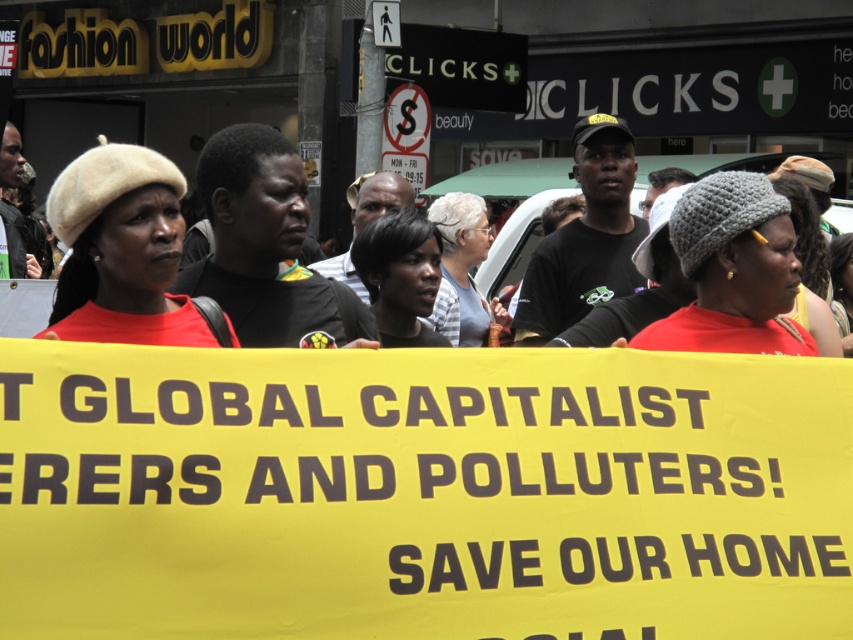
Looking at this image, how much distance is there between gray knitted hat at center and dark brown hair at center?

gray knitted hat at center and dark brown hair at center are 4.28 feet apart.

The width and height of the screenshot is (853, 640). Describe the element at coordinates (732, 272) in the screenshot. I see `gray knitted hat at center` at that location.

Who is more distant from viewer, (645,342) or (437,248)?

The point (437,248) is more distant.

Where is `gray knitted hat at center`? The height and width of the screenshot is (640, 853). gray knitted hat at center is located at coordinates (732, 272).

Who is positioned more to the left, beige felt beret at left or dark brown hair at center?

beige felt beret at left

Is point (115, 275) behind point (378, 268)?

That is False.

Is point (105, 216) closer to camera compared to point (402, 253)?

Yes, it is in front of point (402, 253).

Find the location of a particular element. Image resolution: width=853 pixels, height=640 pixels. beige felt beret at left is located at coordinates (123, 252).

Is dark brown hair at center below gray knitted hat at upper center?

Incorrect, dark brown hair at center is not positioned below gray knitted hat at upper center.

Is point (415, 256) more distant than point (838, 243)?

No, it is not.

Between point (405, 266) and point (849, 317), which one is positioned behind?

Positioned behind is point (849, 317).

Locate an element on the screen. This screenshot has height=640, width=853. dark brown hair at center is located at coordinates (399, 275).